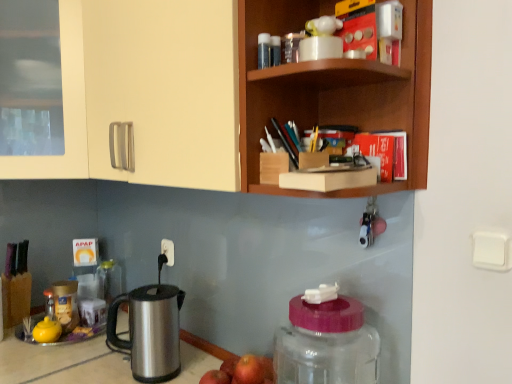
How much space does transparent plastic bottle at upper center, the 2th bottle in the right-to-left sequence, occupy horizontally?

transparent plastic bottle at upper center, the 2th bottle in the right-to-left sequence, is 1.34 inches in width.

The width and height of the screenshot is (512, 384). Describe the element at coordinates (264, 50) in the screenshot. I see `transparent plastic bottle at upper center, the second bottle from the back` at that location.

This screenshot has width=512, height=384. In order to click on white plastic electric outlet at center in this screenshot , I will do `click(168, 251)`.

The width and height of the screenshot is (512, 384). Describe the element at coordinates (66, 304) in the screenshot. I see `metallic silver jar at left, which appears as the third bottle when viewed from the top` at that location.

How much space does metallic silver jar at left, which is counted as the 1th bottle, starting from the back, occupy horizontally?

10.12 centimeters.

What do you see at coordinates (150, 331) in the screenshot?
I see `stainless steel kettle at lower left` at bounding box center [150, 331].

Image resolution: width=512 pixels, height=384 pixels. What are the coordinates of `transparent plastic bottle at upper center, positioned as the second bottle in left-to-right order` in the screenshot? It's located at (264, 50).

Is point (170, 247) behind point (496, 250)?

Yes, it is behind point (496, 250).

Is white plastic electric outlet at center in contact with white plastic light switch at upper right?

white plastic electric outlet at center and white plastic light switch at upper right are not in contact.

Which is more to the right, white plastic electric outlet at center or white plastic light switch at upper right?

white plastic light switch at upper right.

Is white plastic electric outlet at center bigger than stainless steel kettle at lower left?

No.

You are a GUI agent. You are given a task and a screenshot of the screen. Output one action in this format:
    pyautogui.click(x=<x>, y=<y>)
    Task: Click on the kettle to the right of white plastic electric outlet at center
    Image resolution: width=512 pixels, height=384 pixels.
    Given the screenshot: What is the action you would take?
    pyautogui.click(x=150, y=331)

From the image's perspective, relative to stainless steel kettle at lower left, is white plastic electric outlet at center above or below?

white plastic electric outlet at center is above stainless steel kettle at lower left.

Can you confirm if white plastic electric outlet at center is taller than stainless steel kettle at lower left?

In fact, white plastic electric outlet at center may be shorter than stainless steel kettle at lower left.

Between transparent plastic bottle at lower right, the first bottle viewed from the front, and transparent plastic bottle at upper center, positioned as the 2th bottle in front-to-back order, which one is positioned in front?

transparent plastic bottle at lower right, the first bottle viewed from the front.

From a real-world perspective, which is physically below, transparent plastic bottle at lower right, which is the 3th bottle from left to right, or transparent plastic bottle at upper center, positioned as the 2th bottle in front-to-back order?

In real-world perspective, transparent plastic bottle at lower right, which is the 3th bottle from left to right, is lower.

Can you tell me how much transparent plastic bottle at lower right, the 1th bottle from the right, and transparent plastic bottle at upper center, which is the third bottle in bottom-to-top order, differ in facing direction?

The facing directions of transparent plastic bottle at lower right, the 1th bottle from the right, and transparent plastic bottle at upper center, which is the third bottle in bottom-to-top order, are 3.28 degrees apart.

Who is shorter, transparent plastic bottle at lower right, which is the 3th bottle from left to right, or transparent plastic bottle at upper center, which is the third bottle in bottom-to-top order?

Standing shorter between the two is transparent plastic bottle at upper center, which is the third bottle in bottom-to-top order.

Is the depth of matte cream cabinet at upper left greater than that of white plastic light switch at upper right?

No, matte cream cabinet at upper left is in front of white plastic light switch at upper right.

Is matte cream cabinet at upper left at the left side of white plastic light switch at upper right?

Yes.

Measure the distance between matte cream cabinet at upper left and white plastic light switch at upper right.

The distance of matte cream cabinet at upper left from white plastic light switch at upper right is 28.90 inches.

From the image's perspective, is matte cream cabinet at upper left located above or below white plastic light switch at upper right?

Clearly, from the image's perspective, matte cream cabinet at upper left is above white plastic light switch at upper right.

Who is bigger, matte cream cabinet at upper left or transparent plastic bottle at lower right, the 2th bottle positioned from the bottom?

With larger size is matte cream cabinet at upper left.

At what (x,y) coordinates should I click in order to perform the action: click on cabinetry located above the transparent plastic bottle at lower right, which is the 3th bottle from left to right (from a real-world perspective). Please return your answer as a coordinate pair (x, y). This screenshot has height=384, width=512. Looking at the image, I should click on [x=219, y=92].

Does matte cream cabinet at upper left have a greater height compared to transparent plastic bottle at lower right, which is counted as the second bottle, starting from the top?

Yes, matte cream cabinet at upper left is taller than transparent plastic bottle at lower right, which is counted as the second bottle, starting from the top.

Based on the photo, from a real-world perspective, relative to transparent plastic bottle at lower right, the third bottle from the back, is matte cream cabinet at upper left vertically above or below?

matte cream cabinet at upper left is above transparent plastic bottle at lower right, the third bottle from the back.

Considering the positions of objects white plastic light switch at upper right and matte cream cabinet at upper left in the image provided, who is more to the left, white plastic light switch at upper right or matte cream cabinet at upper left?

matte cream cabinet at upper left.

Consider the image. Who is smaller, white plastic light switch at upper right or matte cream cabinet at upper left?

Smaller between the two is white plastic light switch at upper right.

From the image's perspective, which object appears higher, white plastic light switch at upper right or matte cream cabinet at upper left?

matte cream cabinet at upper left.

Between transparent plastic bottle at lower right, which is the 3th bottle from left to right, and white plastic electric outlet at center, which one has smaller width?

With smaller width is white plastic electric outlet at center.

How different are the orientations of transparent plastic bottle at lower right, the first bottle viewed from the front, and white plastic electric outlet at center in degrees?

The angle between the facing direction of transparent plastic bottle at lower right, the first bottle viewed from the front, and the facing direction of white plastic electric outlet at center is 0.174 degrees.

Is point (296, 307) less distant than point (167, 249)?

Yes, point (296, 307) is in front of point (167, 249).

Find the location of a particular element. electric outlet behind the white plastic light switch at upper right is located at coordinates (168, 251).

Where is `kettle lying below the white plastic electric outlet at center (from the image's perspective)`? kettle lying below the white plastic electric outlet at center (from the image's perspective) is located at coordinates (150, 331).

Considering their positions, is stainless steel kettle at lower left positioned closer to red matte apple at lower center than matte cream cabinet at upper left?

stainless steel kettle at lower left.

Which object lies nearer to the anchor point white plastic light switch at upper right, transparent plastic bottle at lower right, the 1th bottle from the right, or stainless steel kettle at lower left?

The object closer to white plastic light switch at upper right is transparent plastic bottle at lower right, the 1th bottle from the right.

When comparing their distances from white plastic electric outlet at center, does stainless steel kettle at lower left or matte cream cabinet at upper left seem closer?

Among the two, stainless steel kettle at lower left is located nearer to white plastic electric outlet at center.

Considering their positions, is stainless steel kettle at lower left positioned closer to wooden shelf at upper right than white plastic light switch at upper right?

white plastic light switch at upper right.

When comparing their distances from white plastic electric outlet at center, does red matte apple at lower center or metallic silver jar at left, marked as the 1th bottle in a bottom-to-top arrangement, seem closer?

Based on the image, metallic silver jar at left, marked as the 1th bottle in a bottom-to-top arrangement, appears to be nearer to white plastic electric outlet at center.

When comparing their distances from wooden shelf at upper right, does white plastic electric outlet at center or white plastic light switch at upper right seem further?

white plastic electric outlet at center is positioned further to the anchor wooden shelf at upper right.

Considering their positions, is red matte apple at lower center positioned further to white plastic electric outlet at center than stainless steel kettle at lower left?

Based on the image, red matte apple at lower center appears to be further to white plastic electric outlet at center.

Looking at the image, which one is located further to white plastic light switch at upper right, stainless steel kettle at lower left or metallic silver jar at left, marked as the 1th bottle in a bottom-to-top arrangement?

metallic silver jar at left, marked as the 1th bottle in a bottom-to-top arrangement, is positioned further to the anchor white plastic light switch at upper right.

At what (x,y) coordinates should I click in order to perform the action: click on apple between metallic silver jar at left, which appears as the third bottle when viewed from the top, and transparent plastic bottle at lower right, which is the 3th bottle from left to right. Please return your answer as a coordinate pair (x, y). Looking at the image, I should click on (249, 370).

Locate an element on the screen. The height and width of the screenshot is (384, 512). shelf between transparent plastic bottle at upper center, the 2th bottle in the right-to-left sequence, and transparent plastic bottle at lower right, which is counted as the second bottle, starting from the top, in the vertical direction is located at coordinates (334, 91).

What are the coordinates of `electric outlet between metallic silver jar at left, acting as the 3th bottle starting from the right, and red matte apple at lower center from left to right` in the screenshot? It's located at (168, 251).

You are a GUI agent. You are given a task and a screenshot of the screen. Output one action in this format:
    pyautogui.click(x=<x>, y=<y>)
    Task: Click on the electric outlet between wooden shelf at upper right and metallic silver jar at left, which is counted as the 1th bottle, starting from the back, in the front-back direction
    The width and height of the screenshot is (512, 384).
    Given the screenshot: What is the action you would take?
    pyautogui.click(x=168, y=251)